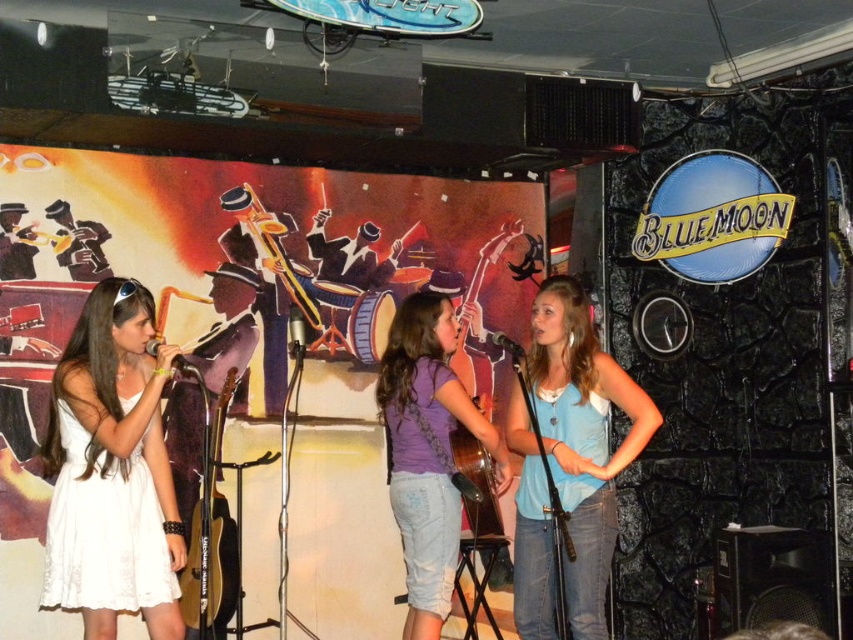
Who is positioned more to the right, purple denim shorts at center or matte black microphone at left?

From the viewer's perspective, purple denim shorts at center appears more on the right side.

Does purple denim shorts at center have a lesser height compared to matte black microphone at left?

Incorrect, purple denim shorts at center's height does not fall short of matte black microphone at left's.

The height and width of the screenshot is (640, 853). Find the location of `purple denim shorts at center`. purple denim shorts at center is located at coordinates (428, 452).

Between point (183, 582) and point (154, 349), which one is positioned behind?

The point (183, 582) is behind.

Which is more to the left, gold metallic guitar at center or matte black microphone at left?

matte black microphone at left

Where is `gold metallic guitar at center`? This screenshot has height=640, width=853. gold metallic guitar at center is located at coordinates (210, 531).

Is gold metallic guitar at center thinner than matte black microphone at center?

No.

This screenshot has height=640, width=853. In order to click on gold metallic guitar at center in this screenshot , I will do `click(210, 531)`.

This screenshot has width=853, height=640. I want to click on gold metallic guitar at center, so click(210, 531).